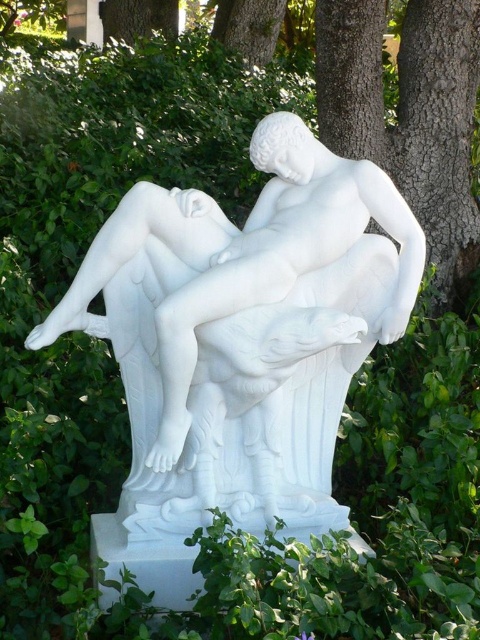
Is white marble statue at center taller than brown rough tree trunk at upper center?

Incorrect, white marble statue at center's height is not larger of brown rough tree trunk at upper center's.

Is point (327, 461) behind point (465, 173)?

That is False.

Does point (346, 369) come farther from viewer compared to point (333, 104)?

No, it is not.

You are a GUI agent. You are given a task and a screenshot of the screen. Output one action in this format:
    pyautogui.click(x=<x>, y=<y>)
    Task: Click on the white marble statue at center
    
    Given the screenshot: What is the action you would take?
    pyautogui.click(x=244, y=326)